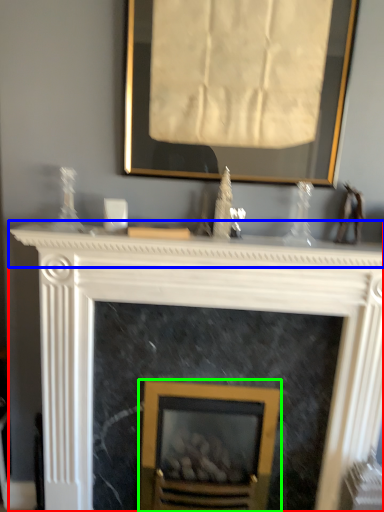
Question: Which object is the farthest from fireplace (highlighted by a red box)? Choose among these: mantle (highlighted by a blue box) or fireplace (highlighted by a green box).

Choices:
 (A) mantle
 (B) fireplace

Answer: (B)